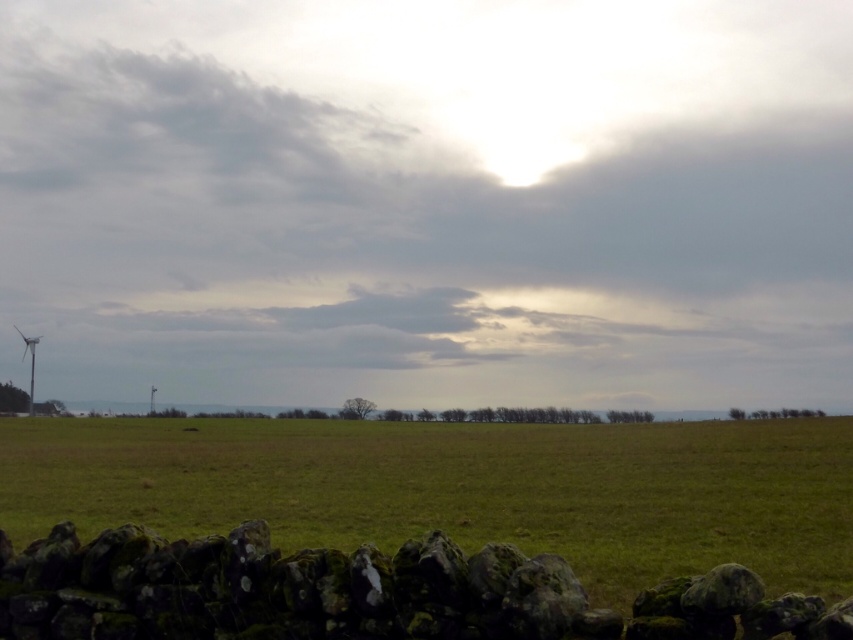
You are a landscape photographer planning to capture the white plastic wind turbine at lower left and the mossy stone wall at lower center in the same frame. Based on their positions, which object would appear closer to the camera in your photograph?

The mossy stone wall at lower center appears closer to the camera because it is positioned over the white plastic wind turbine at lower left, indicating it is in front of the turbine.

You are standing in front of the scene and want to take a photo that includes both the cloudy sky at upper center and the green grassy field at lower center. Which object will appear closer to the camera in the photo?

The cloudy sky at upper center will appear closer to the camera because it is further to the viewer than the green grassy field at lower center.

You are a photographer planning to capture the cloudy sky at upper center and the white plastic wind turbine at lower left in a single frame. Which object occupies a larger portion of the image horizontally?

The cloudy sky at upper center occupies a larger horizontal portion of the image because its width surpasses that of the white plastic wind turbine at lower left.